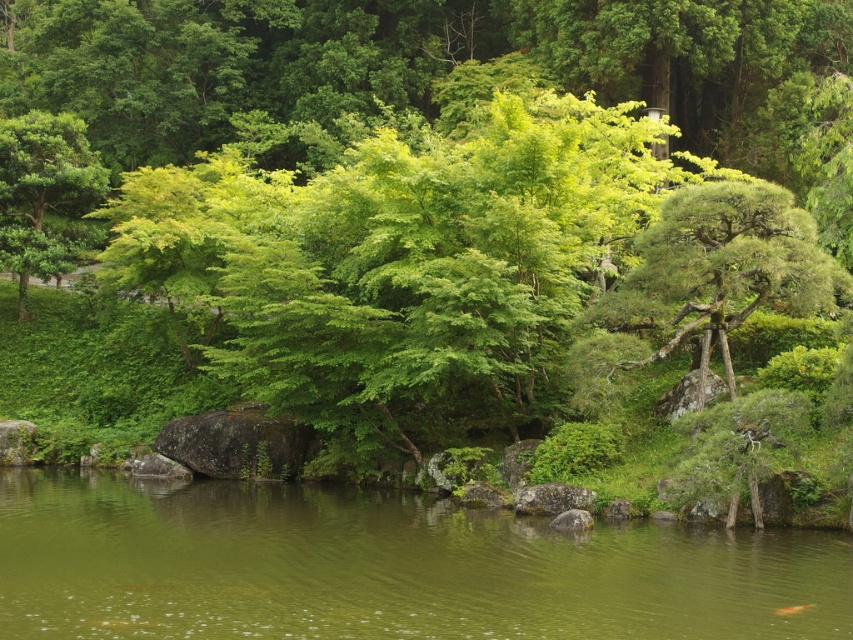
You are standing in the natural landscape and want to walk from the green leafy tree at left to the green water at center. Which direction should you head?

You should head to the right since the green water at center is located to the right of the green leafy tree at left.

You are standing at the edge of the green water at center and want to look up at the green leafy tree at left. In which direction should you turn your head?

You should turn your head upward because the green water at center is below the green leafy tree at left, so looking up will allow you to see the tree.